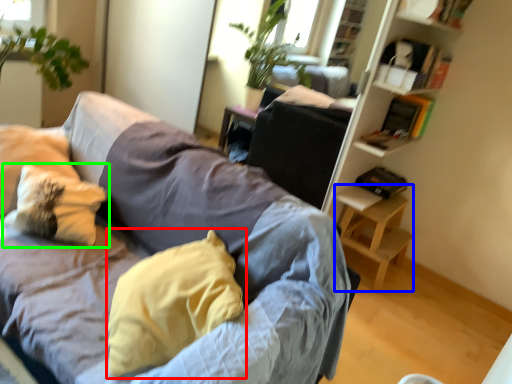
Question: Based on their relative distances, which object is nearer to pillow (highlighted by a red box)? Choose from table (highlighted by a blue box) and pillow (highlighted by a green box).

Choices:
 (A) table
 (B) pillow

Answer: (B)